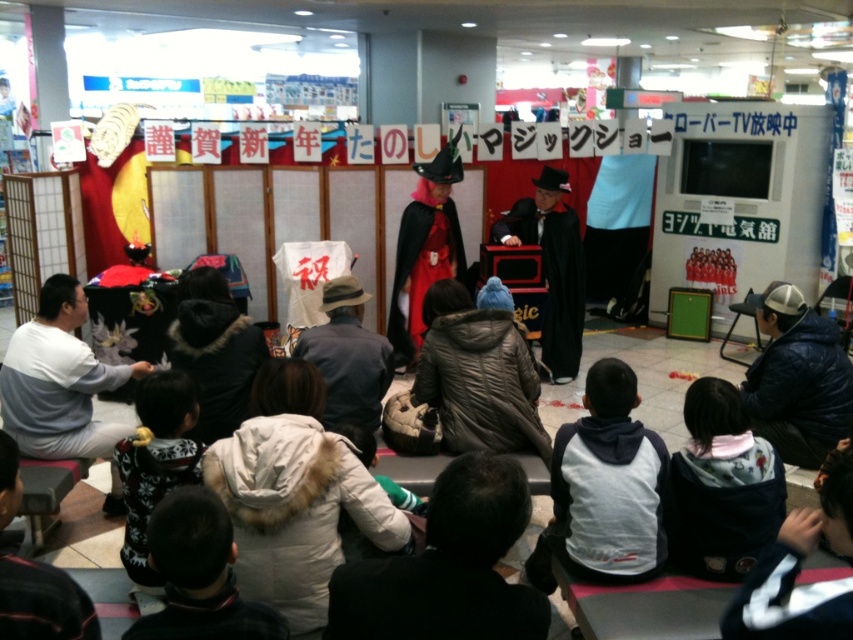
Is fluffy pink hoodie at lower right thinner than fluffy white sweater at lower left?

No, fluffy pink hoodie at lower right is not thinner than fluffy white sweater at lower left.

Does fluffy pink hoodie at lower right appear on the right side of fluffy white sweater at lower left?

Yes, fluffy pink hoodie at lower right is to the right of fluffy white sweater at lower left.

In order to click on fluffy pink hoodie at lower right in this screenshot , I will do tap(721, 486).

Based on the photo, can you confirm if fluffy pink hoodie at lower right is positioned to the left of shiny red cape at center?

No, fluffy pink hoodie at lower right is not to the left of shiny red cape at center.

Describe the element at coordinates (721, 486) in the screenshot. This screenshot has width=853, height=640. I see `fluffy pink hoodie at lower right` at that location.

You are a GUI agent. You are given a task and a screenshot of the screen. Output one action in this format:
    pyautogui.click(x=<x>, y=<y>)
    Task: Click on the fluffy pink hoodie at lower right
    The height and width of the screenshot is (640, 853).
    Given the screenshot: What is the action you would take?
    pyautogui.click(x=721, y=486)

Is white fleece jacket at lower center shorter than fluffy pink hoodie at lower right?

No.

Which is behind, point (556, 454) or point (755, 456)?

Positioned behind is point (556, 454).

Find the location of a particular element. The height and width of the screenshot is (640, 853). white fleece jacket at lower center is located at coordinates pos(608,483).